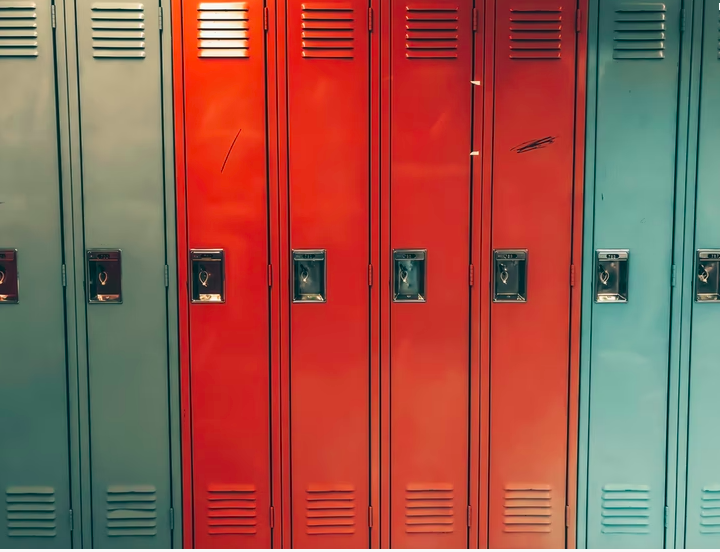
Identify the location of the lower vents of lockers. This screenshot has height=552, width=720. (711, 498), (629, 495), (523, 502), (428, 504), (343, 504), (225, 508), (121, 508), (32, 512).